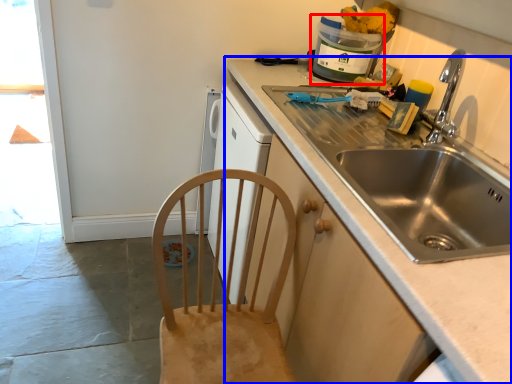
Question: Which of the following is the closest to the observer, appliance (highlighted by a red box) or countertop (highlighted by a blue box)?

Choices:
 (A) appliance
 (B) countertop

Answer: (B)